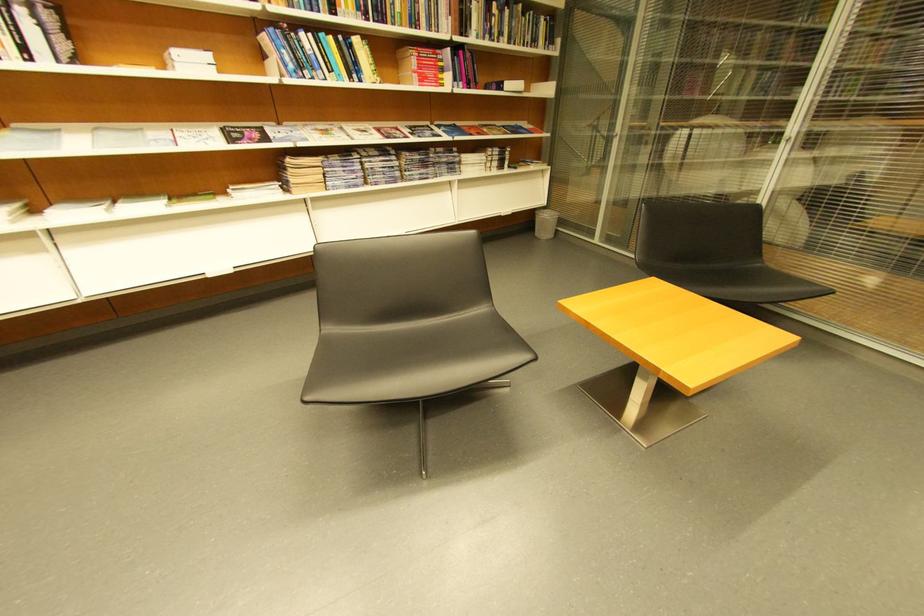
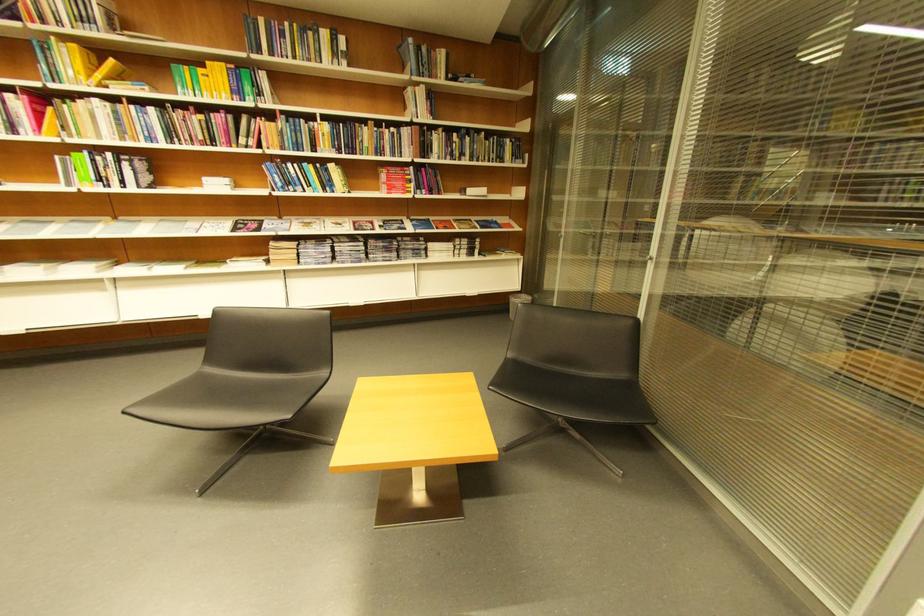
Locate, in the second image, the point that corresponds to [434,55] in the first image.

(403, 172)